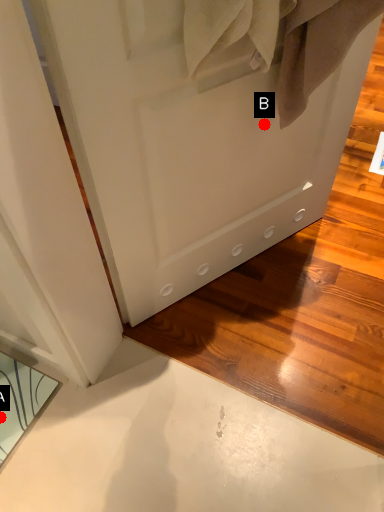
Question: Two points are circled on the image, labeled by A and B beside each circle. Which point is closer to the camera?

Choices:
 (A) A is closer
 (B) B is closer

Answer: (B)